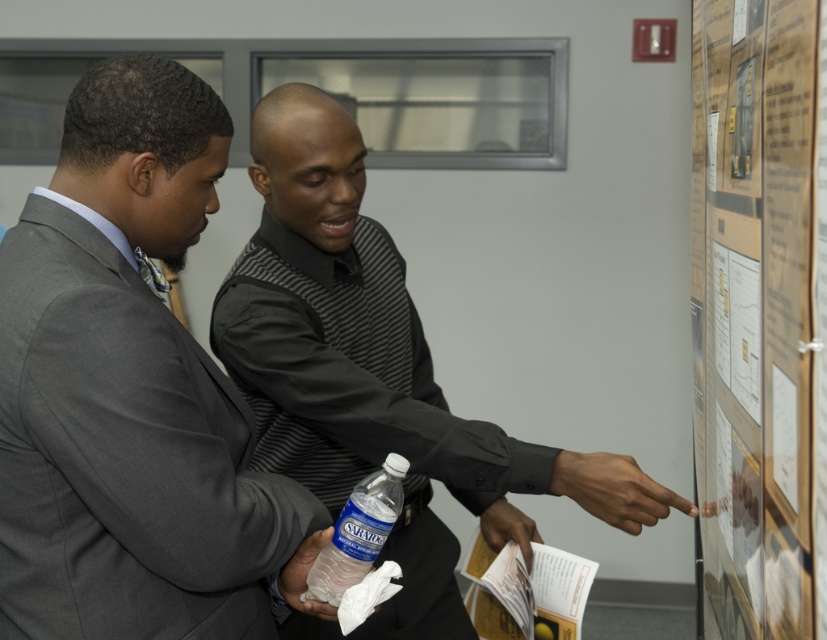
Is black matte shirt at center bigger than paperboard poster at right?

Yes.

Who is more forward, (404, 627) or (696, 563)?

Positioned in front is point (696, 563).

Is point (280, 460) closer to viewer compared to point (701, 298)?

No, it is not.

You are a GUI agent. You are given a task and a screenshot of the screen. Output one action in this format:
    pyautogui.click(x=<x>, y=<y>)
    Task: Click on the black matte shirt at center
    The height and width of the screenshot is (640, 827).
    Given the screenshot: What is the action you would take?
    pyautogui.click(x=376, y=374)

Which is above, gray suit at left or black matte shirt at center?

Positioned higher is gray suit at left.

What do you see at coordinates (131, 394) in the screenshot?
I see `gray suit at left` at bounding box center [131, 394].

The width and height of the screenshot is (827, 640). Identify the location of gray suit at left. (131, 394).

Can you confirm if gray suit at left is taller than translucent plastic water bottle at lower center?

Correct, gray suit at left is much taller as translucent plastic water bottle at lower center.

Does gray suit at left lie behind translucent plastic water bottle at lower center?

No, gray suit at left is closer to the viewer.

Between point (10, 300) and point (371, 524), which one is positioned behind?

The point (371, 524) is behind.

Locate an element on the screen. Image resolution: width=827 pixels, height=640 pixels. gray suit at left is located at coordinates (131, 394).